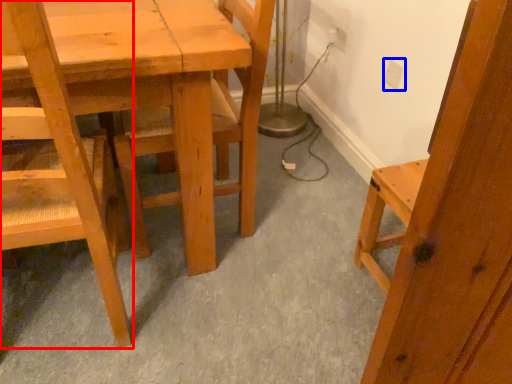
Question: Among these objects, which one is farthest to the camera, chair (highlighted by a red box) or electric outlet (highlighted by a blue box)?

Choices:
 (A) chair
 (B) electric outlet

Answer: (B)